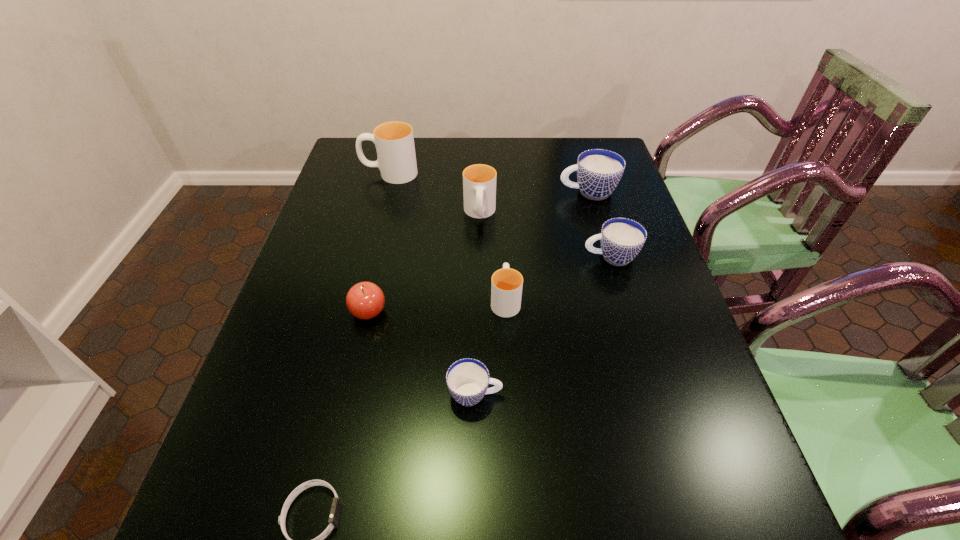
Find the location of a particular element. The height and width of the screenshot is (540, 960). vacant space located on the side of the third nearest cup with the handle is located at coordinates (533, 257).

The width and height of the screenshot is (960, 540). Identify the location of free space located on the side of the third nearest cup with the handle. (510, 257).

The image size is (960, 540). Find the location of `free location located 0.050m on the side of the third nearest cup with the handle`. free location located 0.050m on the side of the third nearest cup with the handle is located at coordinates (564, 257).

The width and height of the screenshot is (960, 540). What are the coordinates of `free spot located 0.290m on the side of the leftmost blue cup with the handle` in the screenshot? It's located at (648, 394).

Where is `object that is at the far edge`? The image size is (960, 540). object that is at the far edge is located at coordinates (394, 141).

The image size is (960, 540). I want to click on cup located at the left edge, so click(x=394, y=141).

This screenshot has height=540, width=960. I want to click on apple at the left edge, so click(365, 300).

Where is `object at the far left corner`? This screenshot has width=960, height=540. object at the far left corner is located at coordinates (394, 141).

Identify the location of free space at the far edge of the desktop. (464, 139).

You are a GUI agent. You are given a task and a screenshot of the screen. Output one action in this format:
    pyautogui.click(x=<x>, y=<y>)
    Task: Click on the free space at the near edge of the desktop
    The width and height of the screenshot is (960, 540).
    Given the screenshot: What is the action you would take?
    pyautogui.click(x=300, y=534)